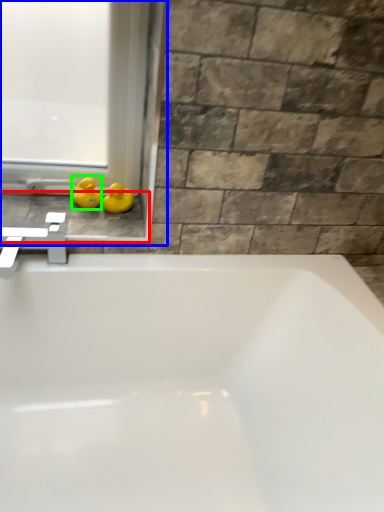
Question: Considering the real-world distances, which object is farthest from window sill (highlighted by a red box)? window frame (highlighted by a blue box) or duck (highlighted by a green box)?

Choices:
 (A) window frame
 (B) duck

Answer: (A)